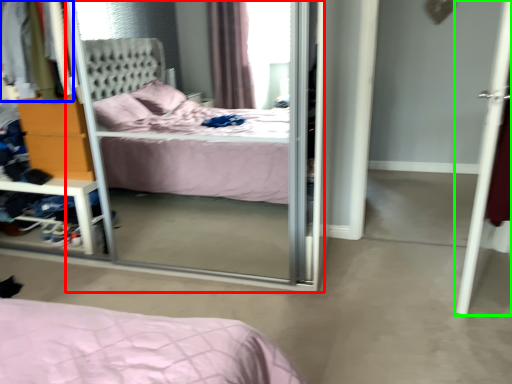
Question: Based on their relative distances, which object is nearer to screen door (highlighted by a red box)? Choose from clothing (highlighted by a blue box) and door (highlighted by a green box).

Choices:
 (A) clothing
 (B) door

Answer: (A)